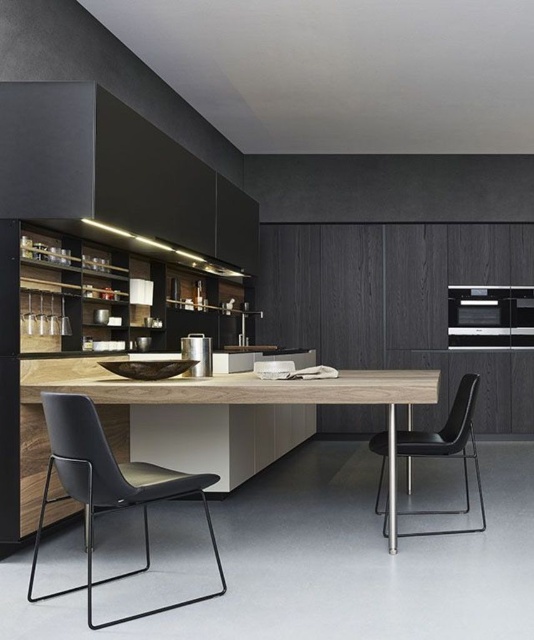
What do you see at coordinates (253, 388) in the screenshot?
I see `light wood countertop at center` at bounding box center [253, 388].

Can you confirm if light wood countertop at center is shorter than satin silver oven at center?

Yes.

Is point (123, 394) positioned after point (470, 301)?

No.

Locate an element on the screen. The image size is (534, 640). light wood countertop at center is located at coordinates (253, 388).

Can you confirm if matte black exhaust hood at upper left is taller than satin silver oven at center?

Indeed, matte black exhaust hood at upper left has a greater height compared to satin silver oven at center.

Does matte black exhaust hood at upper left have a lesser width compared to satin silver oven at center?

In fact, matte black exhaust hood at upper left might be wider than satin silver oven at center.

What are the coordinates of `matte black exhaust hood at upper left` in the screenshot? It's located at (116, 177).

The width and height of the screenshot is (534, 640). I want to click on matte black exhaust hood at upper left, so click(116, 177).

The height and width of the screenshot is (640, 534). In order to click on black leather chair at lower left in this screenshot , I will do `click(107, 488)`.

Who is more forward, (222, 582) or (349, 396)?

Point (222, 582) is more forward.

Between point (131, 500) and point (349, 387), which one is positioned behind?

The point (349, 387) is more distant.

Where is `black leather chair at lower left`? Image resolution: width=534 pixels, height=640 pixels. black leather chair at lower left is located at coordinates (107, 488).